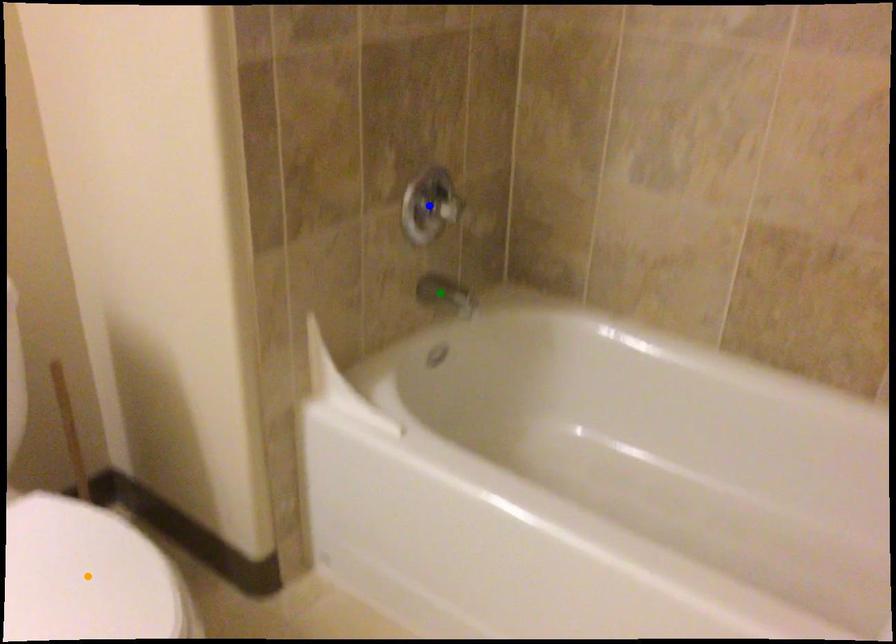
Order these from nearest to farthest:
A) blue point
B) green point
C) orange point

orange point, blue point, green point